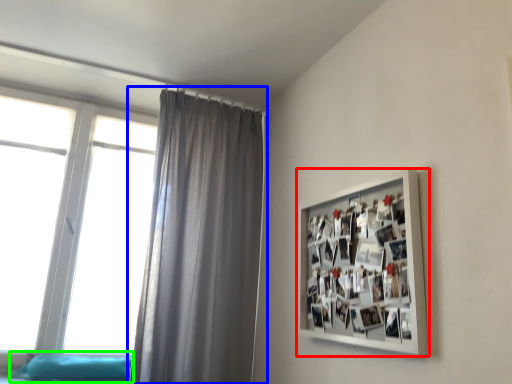
Question: Which object is the farthest from picture frame (highlighted by a red box)? Choose among these: curtain (highlighted by a blue box) or bed frame (highlighted by a green box).

Choices:
 (A) curtain
 (B) bed frame

Answer: (B)